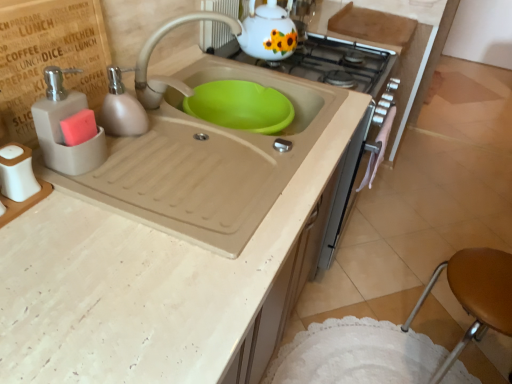
Find the location of a particular element. Image resolution: width=512 pixels, height=384 pixels. free space in front of matte beige soap dispenser at left, the second soap dispenser in the front-to-back sequence is located at coordinates (131, 171).